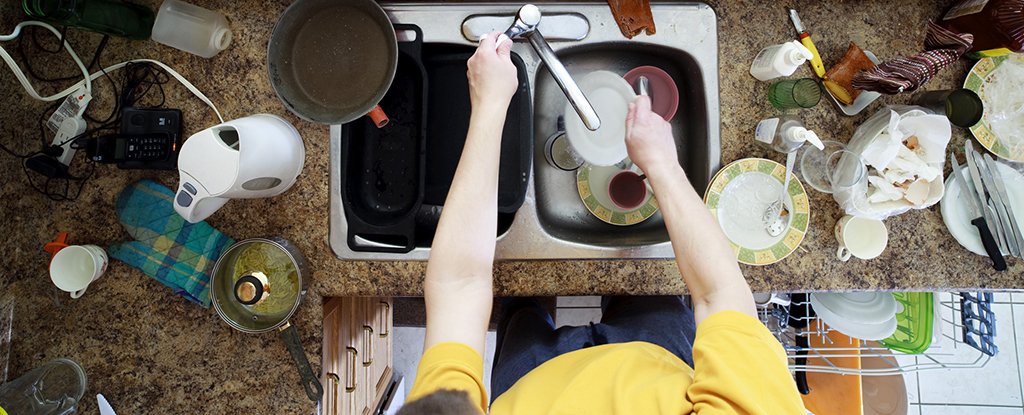
Where is `messy counter area`? The width and height of the screenshot is (1024, 415). messy counter area is located at coordinates (883, 44), (926, 237), (230, 77), (166, 339).